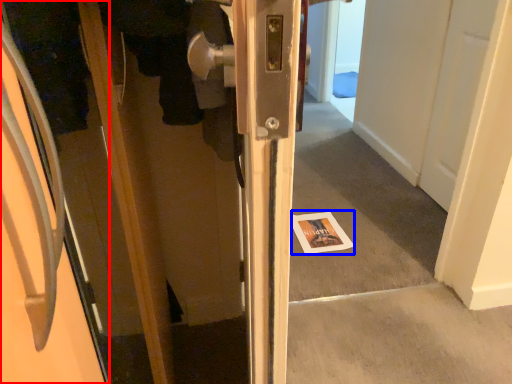
Question: Which of the following is the farthest to the observer, door (highlighted by a red box) or magazine (highlighted by a blue box)?

Choices:
 (A) door
 (B) magazine

Answer: (B)